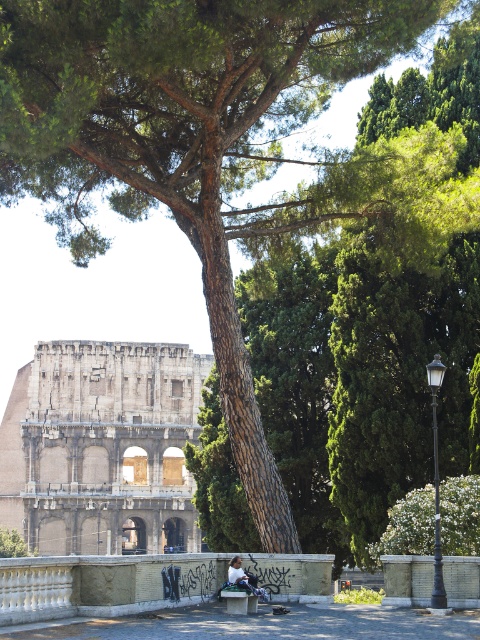
You are standing in front of the Colosseum and see two points marked on the image. The first point is at coordinates point (120, 358) and the second is at point (224, 588). Which point is closer to you?

Point (120, 358) is further to the camera than point (224, 588), so the point closer to you is point (224, 588).